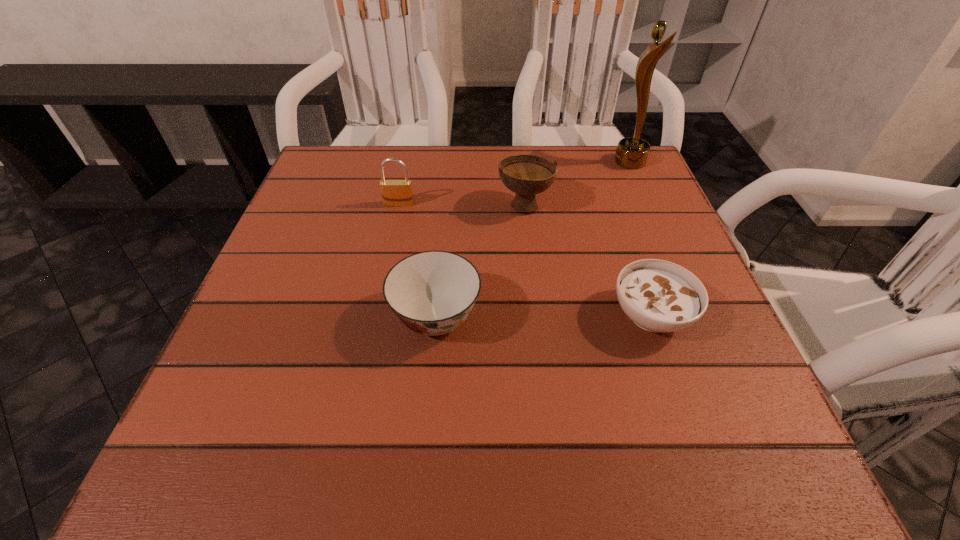
Locate an element on the screen. vacant region that satisfies the following two spatial constraints: 1. on the front-facing side of the padlock; 2. on the left side of the rightmost soup bowl is located at coordinates (375, 315).

Where is `vacant area that satisfies the following two spatial constraints: 1. on the front-facing side of the third object from left to right; 2. on the right side of the padlock`? Image resolution: width=960 pixels, height=540 pixels. vacant area that satisfies the following two spatial constraints: 1. on the front-facing side of the third object from left to right; 2. on the right side of the padlock is located at coordinates (398, 204).

Find the location of `vacant space that satisfies the following two spatial constraints: 1. on the front-facing side of the award; 2. on the front side of the rightmost soup bowl`. vacant space that satisfies the following two spatial constraints: 1. on the front-facing side of the award; 2. on the front side of the rightmost soup bowl is located at coordinates (697, 315).